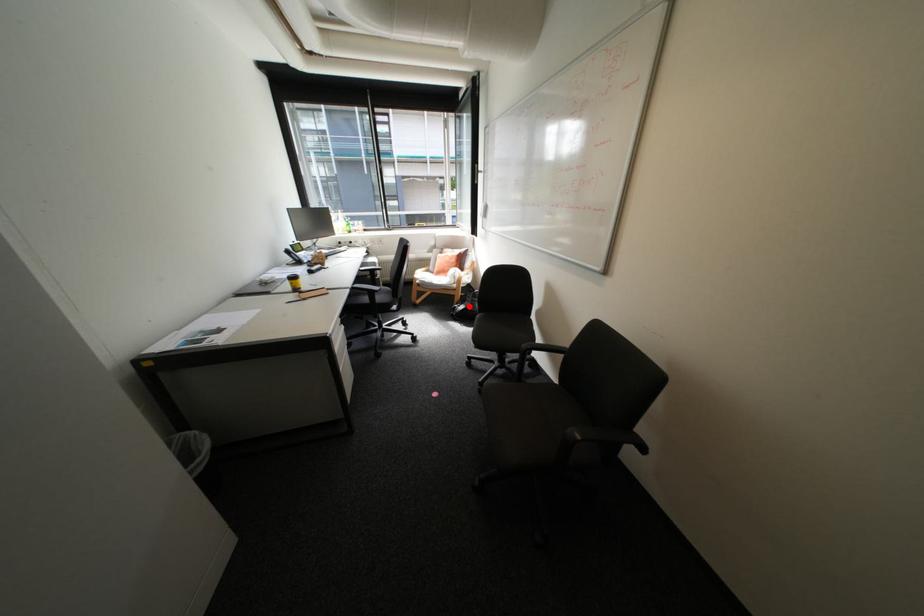
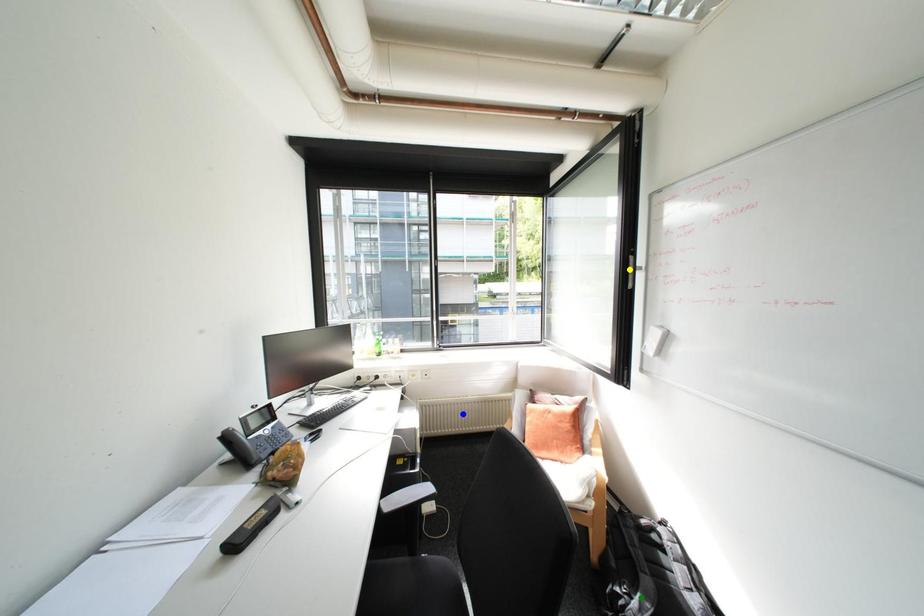
Question: I am providing you with two images of the same scene from different viewpoints. A red point is marked on the first image. You are given multiple points on the second image. Which spot in image 2 lines up with the point in image 1?

Choices:
 (A) green point
 (B) yellow point
 (C) blue point

Answer: (A)